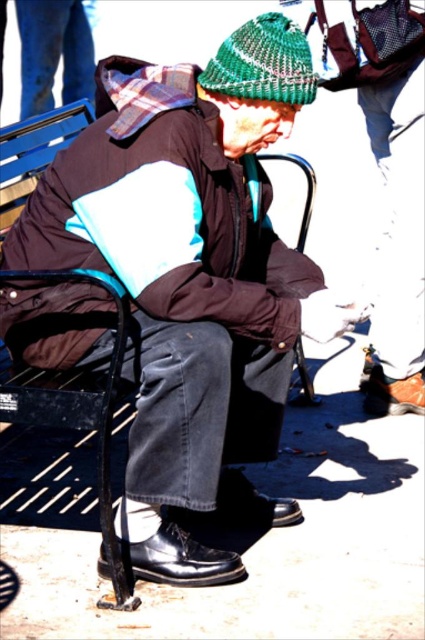
Question: Does brown matte jacket at center appear under green knitted hat at upper center?

Choices:
 (A) yes
 (B) no

Answer: (A)

Question: Which of the following is the closest to the observer?

Choices:
 (A) (297, 104)
 (B) (261, 284)

Answer: (A)

Question: From the image, what is the correct spatial relationship of brown matte jacket at center in relation to green knitted hat at upper center?

Choices:
 (A) above
 (B) below

Answer: (B)

Question: Which object appears closest to the camera in this image?

Choices:
 (A) green knitted hat at upper center
 (B) brown matte jacket at center

Answer: (B)

Question: Where is brown matte jacket at center located in relation to green knitted hat at upper center in the image?

Choices:
 (A) above
 (B) below

Answer: (B)